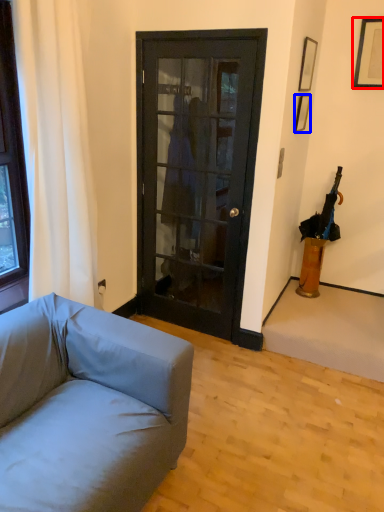
Question: Which point is closer to the camera, picture frame (highlighted by a red box) or picture frame (highlighted by a blue box)?

Choices:
 (A) picture frame
 (B) picture frame

Answer: (B)